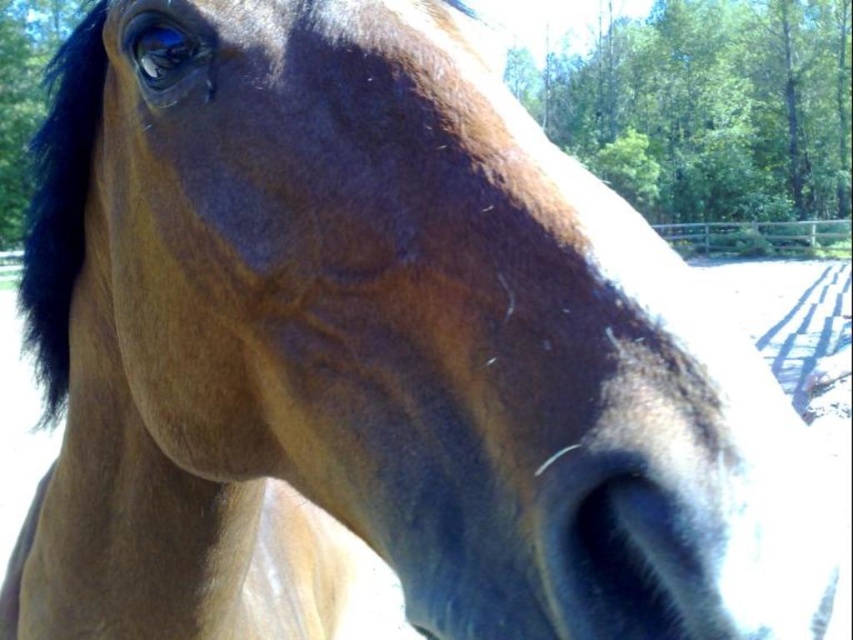
Question: Which object appears farthest from the camera in this image?

Choices:
 (A) brown wooden fence at upper right
 (B) black silky mane at left

Answer: (A)

Question: Is black silky mane at left wider than brown wooden fence at upper right?

Choices:
 (A) yes
 (B) no

Answer: (A)

Question: Among these objects, which one is nearest to the camera?

Choices:
 (A) brown wooden fence at upper right
 (B) black silky mane at left

Answer: (B)

Question: Is black silky mane at left to the right of brown wooden fence at upper right from the viewer's perspective?

Choices:
 (A) yes
 (B) no

Answer: (B)

Question: Which point is farther to the camera?

Choices:
 (A) brown wooden fence at upper right
 (B) black silky mane at left

Answer: (A)

Question: Considering the relative positions of black silky mane at left and brown wooden fence at upper right in the image provided, where is black silky mane at left located with respect to brown wooden fence at upper right?

Choices:
 (A) right
 (B) left

Answer: (B)